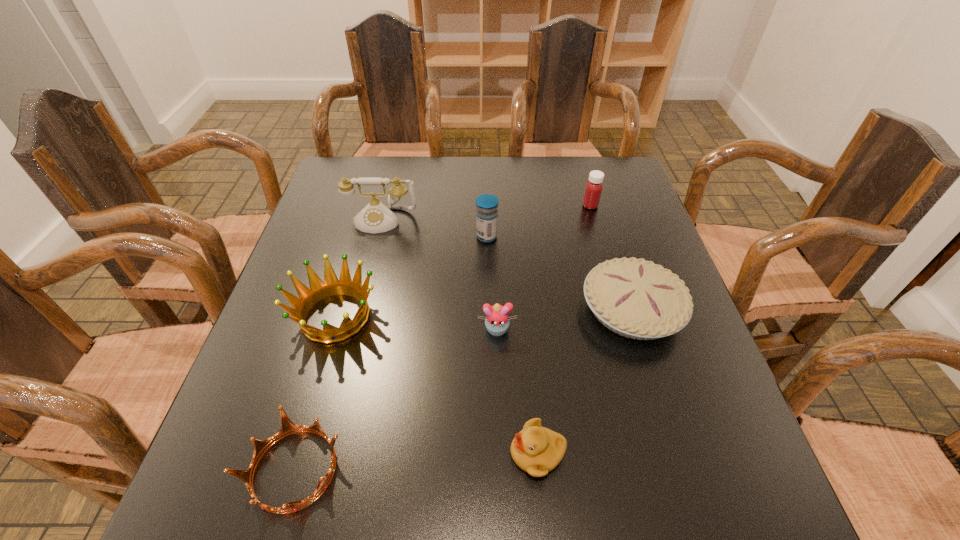
In order to click on vacant point located on the left of the farther medicine in this screenshot , I will do `click(530, 206)`.

You are a GUI agent. You are given a task and a screenshot of the screen. Output one action in this format:
    pyautogui.click(x=<x>, y=<y>)
    Task: Click on the vacant space located 0.230m on the right of the taller crown
    
    Given the screenshot: What is the action you would take?
    pyautogui.click(x=484, y=316)

Find the location of a particular element. This screenshot has height=540, width=960. free space located on the face of the cupcake is located at coordinates (502, 494).

The width and height of the screenshot is (960, 540). What are the coordinates of `free region located 0.280m on the front of the pie` in the screenshot? It's located at (689, 496).

The height and width of the screenshot is (540, 960). I want to click on vacant space located 0.390m at the beak of the duckling, so click(286, 453).

Locate an element on the screen. vacant space located 0.120m at the beak of the duckling is located at coordinates coord(441,453).

This screenshot has width=960, height=540. In order to click on vacant space located at the beak of the duckling in this screenshot , I will do `click(400, 453)`.

At what (x,y) coordinates should I click in order to perform the action: click on vacant space situated on the right of the shorter crown. Please return your answer as a coordinate pair (x, y). Looking at the image, I should click on (579, 469).

Find the location of a particular element. The height and width of the screenshot is (540, 960). object that is at the far edge is located at coordinates (593, 190).

Identify the location of duckling that is at the near edge. (537, 450).